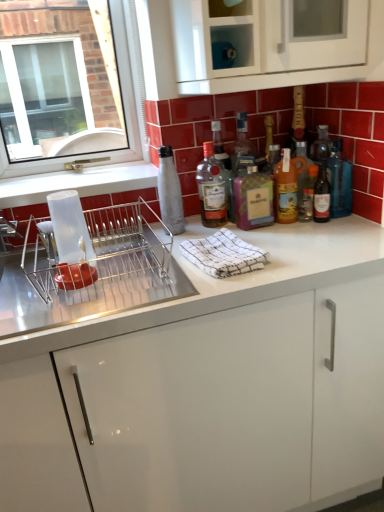
I want to click on free location in front of translucent glass bottle at right, the 1th bottle when ordered from right to left, so click(x=343, y=229).